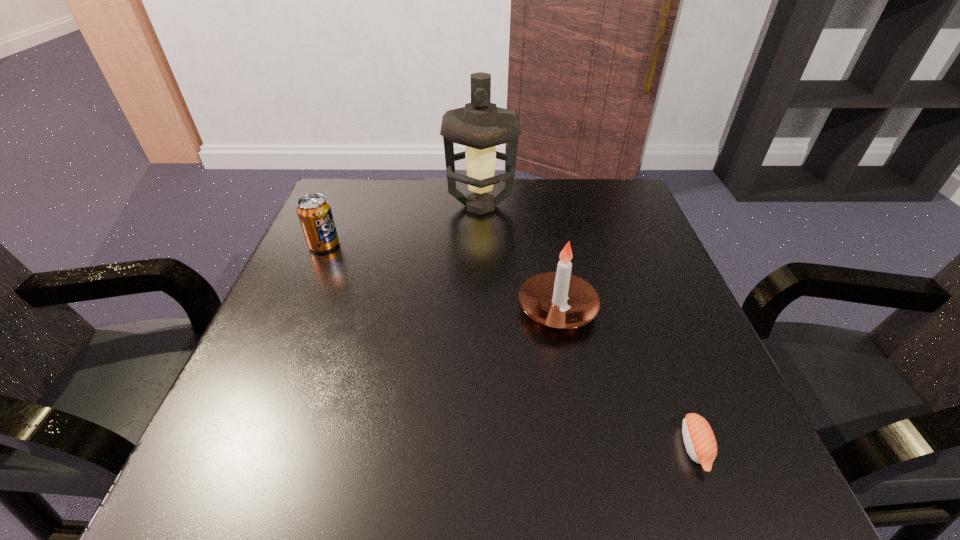
In the image, there is a desktop. What are the coordinates of `vacant space at the far left corner` in the screenshot? It's located at (334, 204).

Find the location of a particular element. free space at the near left corner of the desktop is located at coordinates (206, 465).

Where is `blank space at the far right corner of the desktop`? blank space at the far right corner of the desktop is located at coordinates (642, 228).

Identify the location of unoccupied position between the oil lamp and the nearest object. This screenshot has height=540, width=960. (588, 326).

Identify the location of free spot between the rightmost object and the candle. (626, 378).

The height and width of the screenshot is (540, 960). I want to click on free space that is in between the candle and the soda can, so click(441, 276).

Identify the location of blank region between the leftmost object and the sushi. This screenshot has height=540, width=960. (510, 346).

Where is `unoccupied area between the second tallest object and the nearest object`? unoccupied area between the second tallest object and the nearest object is located at coordinates (626, 378).

Locate an element on the screen. The image size is (960, 540). free space between the second farthest object and the shortest object is located at coordinates (510, 346).

The height and width of the screenshot is (540, 960). What are the coordinates of `empty space between the soda can and the tallest object` in the screenshot? It's located at (402, 225).